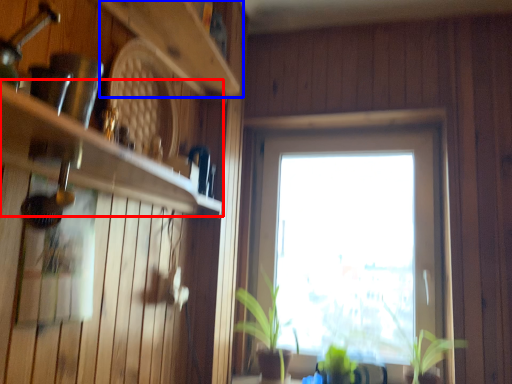
Question: Which point is further to the camera, shelf (highlighted by a red box) or shelf (highlighted by a blue box)?

Choices:
 (A) shelf
 (B) shelf

Answer: (B)